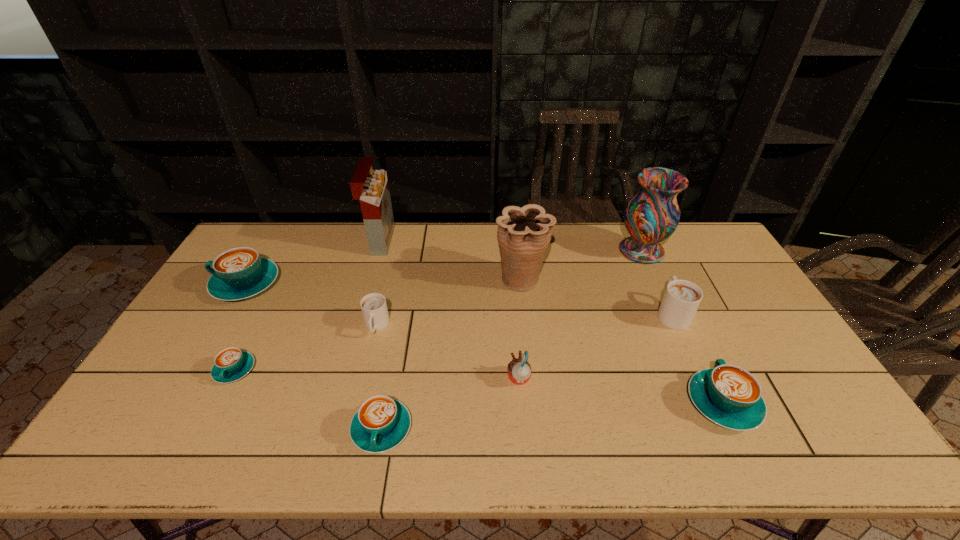
This screenshot has width=960, height=540. I want to click on cigarette case, so point(370,187).

Where is `vase`? vase is located at coordinates (652, 215).

Where is `the third tallest object`? The image size is (960, 540). the third tallest object is located at coordinates (524, 234).

The width and height of the screenshot is (960, 540). In order to click on the right white cappuccino in this screenshot , I will do `click(682, 298)`.

The width and height of the screenshot is (960, 540). Identify the location of the farthest turquoise cappuccino. (239, 273).

At what (x,y) coordinates should I click in order to perform the action: click on muffin. Please return your answer as a coordinate pair (x, y). This screenshot has width=960, height=540. Looking at the image, I should click on (519, 370).

Where is `the smaller white cappuccino`? the smaller white cappuccino is located at coordinates (374, 309).

Locate an element on the screen. The image size is (960, 540). the rightmost turquoise cappuccino is located at coordinates (728, 395).

Where is `the third biggest turquoise cappuccino`? the third biggest turquoise cappuccino is located at coordinates (381, 423).

The image size is (960, 540). I want to click on the fifth tallest cappuccino, so click(381, 423).